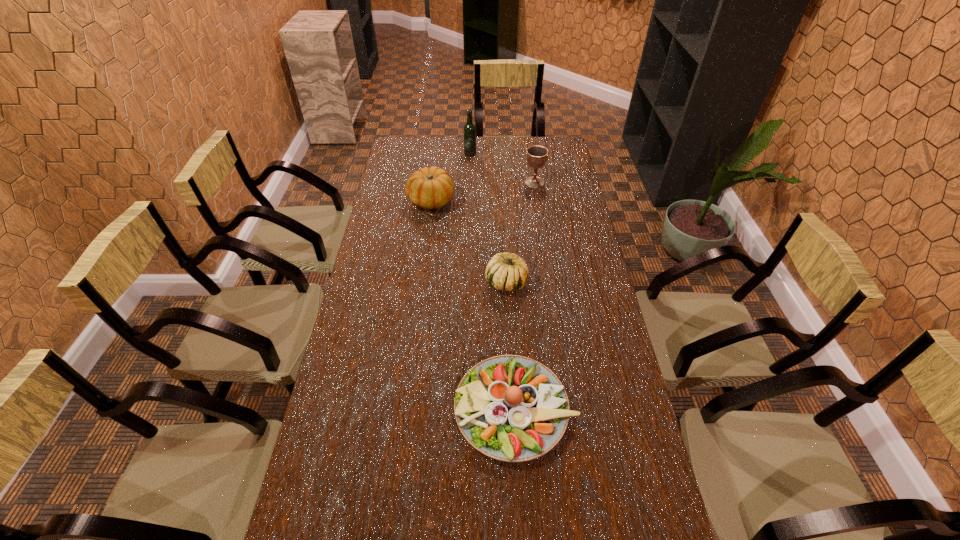
Image resolution: width=960 pixels, height=540 pixels. I want to click on beer bottle, so click(x=469, y=128).

Identify the location of the farthest object. Image resolution: width=960 pixels, height=540 pixels. (469, 128).

You are a GUI agent. You are given a task and a screenshot of the screen. Output one action in this format:
    pyautogui.click(x=<x>, y=<y>)
    Task: Click on the fourth shortest object
    The width and height of the screenshot is (960, 540).
    Given the screenshot: What is the action you would take?
    pyautogui.click(x=537, y=156)

This screenshot has height=540, width=960. I want to click on the farther gourd, so click(x=429, y=188).

I want to click on the left gourd, so click(429, 188).

Identify the location of the second nearest object. This screenshot has width=960, height=540. (505, 271).

The height and width of the screenshot is (540, 960). I want to click on the nearer gourd, so click(505, 271).

I want to click on the shortest object, so click(x=511, y=408).

Locate an element on the screen. The width and height of the screenshot is (960, 540). the nearest object is located at coordinates (511, 408).

What are the coordinates of `free space located 0.240m on the front of the tallest object` in the screenshot? It's located at (469, 186).